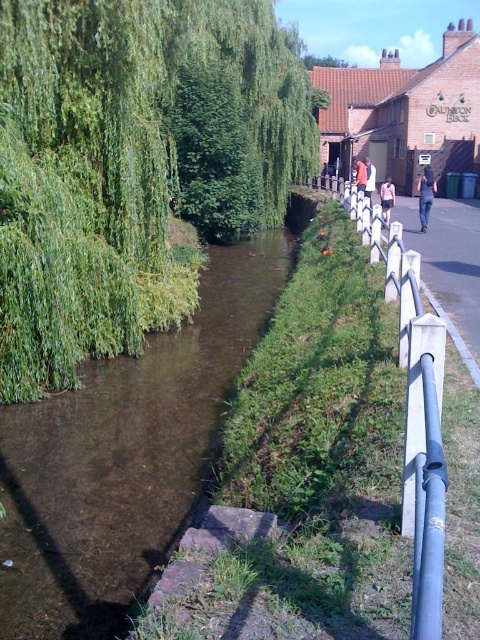
Does blue painted metal fence at right have a greater width compared to white cotton shirt at center?

In fact, blue painted metal fence at right might be narrower than white cotton shirt at center.

Between blue painted metal fence at right and white cotton shirt at center, which one appears on the right side from the viewer's perspective?

Positioned to the right is white cotton shirt at center.

Is point (420, 305) less distant than point (370, 182)?

Yes, it is in front of point (370, 182).

The height and width of the screenshot is (640, 480). What are the coordinates of `blue painted metal fence at right` in the screenshot? It's located at (416, 417).

Based on the photo, is green leafy tree at upper center further to camera compared to orange jacket at center?

Yes, green leafy tree at upper center is behind orange jacket at center.

Which is below, green leafy tree at upper center or orange jacket at center?

orange jacket at center is below.

Is point (338, 64) less distant than point (359, 161)?

No, (338, 64) is further to viewer.

Locate an element on the screen. Image resolution: width=480 pixels, height=640 pixels. green leafy tree at upper center is located at coordinates (324, 61).

Is green leafy tree at upper left shorter than light blue denim shorts at center?

In fact, green leafy tree at upper left may be taller than light blue denim shorts at center.

Who is positioned more to the left, green leafy tree at upper left or light blue denim shorts at center?

Positioned to the left is green leafy tree at upper left.

Locate an element on the screen. The height and width of the screenshot is (640, 480). green leafy tree at upper left is located at coordinates (132, 164).